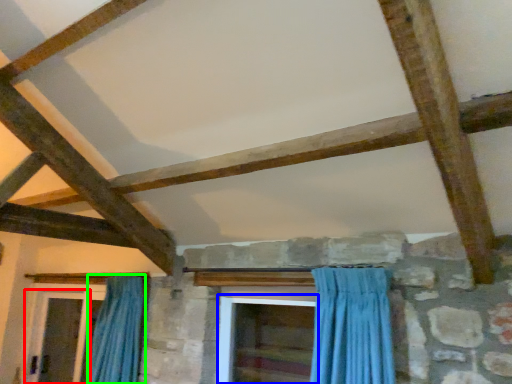
Question: Based on their relative distances, which object is nearer to screen door (highlighted by a red box)? Choose from screen door (highlighted by a blue box) and curtain (highlighted by a green box).

Choices:
 (A) screen door
 (B) curtain

Answer: (B)